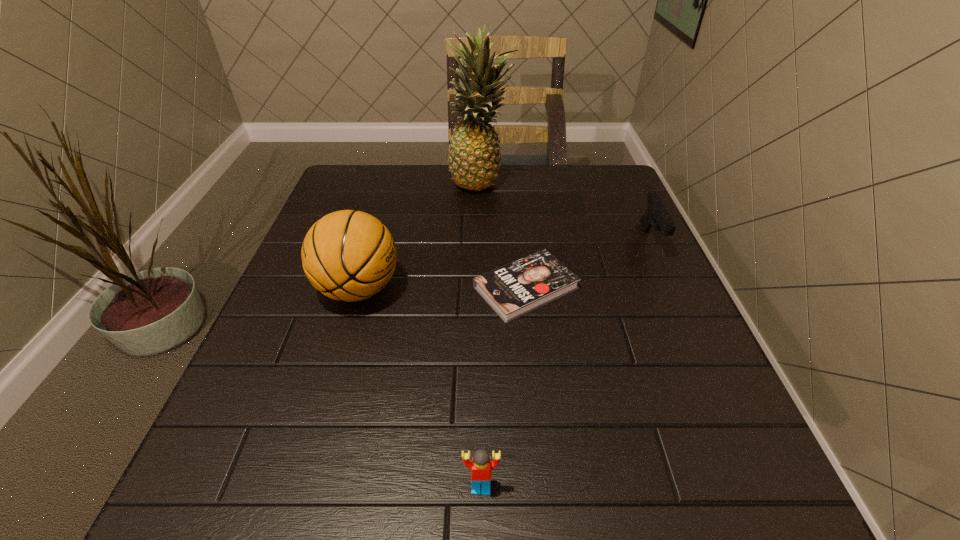
The height and width of the screenshot is (540, 960). What are the coordinates of `vacant space located on the left of the book` in the screenshot? It's located at (311, 288).

I want to click on object that is at the far edge, so click(474, 157).

Where is `object present at the near edge`? The width and height of the screenshot is (960, 540). object present at the near edge is located at coordinates (481, 465).

I want to click on object located in the left edge section of the desktop, so click(x=346, y=255).

The width and height of the screenshot is (960, 540). I want to click on object located at the right edge, so click(x=656, y=215).

This screenshot has height=540, width=960. I want to click on free space at the far edge of the desktop, so click(557, 209).

You are a GUI agent. You are given a task and a screenshot of the screen. Output one action in this format:
    pyautogui.click(x=<x>, y=<y>)
    Task: Click on the vacant area at the near edge of the desktop
    
    Given the screenshot: What is the action you would take?
    pyautogui.click(x=467, y=509)

In the image, there is a desktop. At what (x,y) coordinates should I click in order to perform the action: click on vacant space at the right edge. Please return your answer as a coordinate pair (x, y). Image resolution: width=960 pixels, height=540 pixels. Looking at the image, I should click on (603, 242).

In the image, there is a desktop. Find the location of `free space at the far left corner`. free space at the far left corner is located at coordinates (381, 205).

Image resolution: width=960 pixels, height=540 pixels. What are the coordinates of `free space at the near left corner` in the screenshot? It's located at (214, 484).